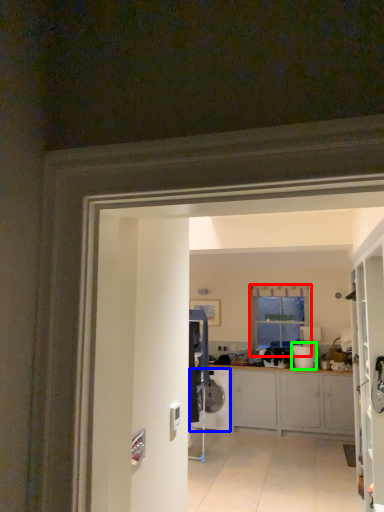
Question: Based on their relative distances, which object is nearer to window (highlighted by a red box)? Choose from washing machine (highlighted by a blue box) and appliance (highlighted by a green box).

Choices:
 (A) washing machine
 (B) appliance

Answer: (B)